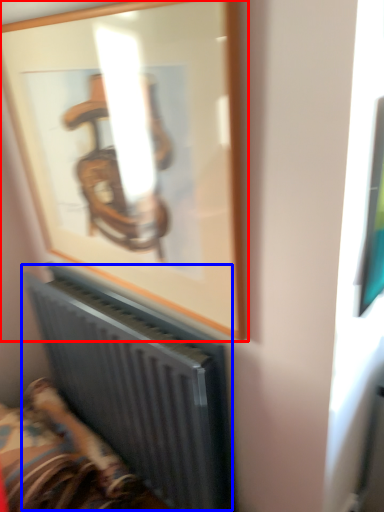
Question: Which object is further to the camera taking this photo, picture frame (highlighted by a red box) or radiator (highlighted by a blue box)?

Choices:
 (A) picture frame
 (B) radiator

Answer: (B)